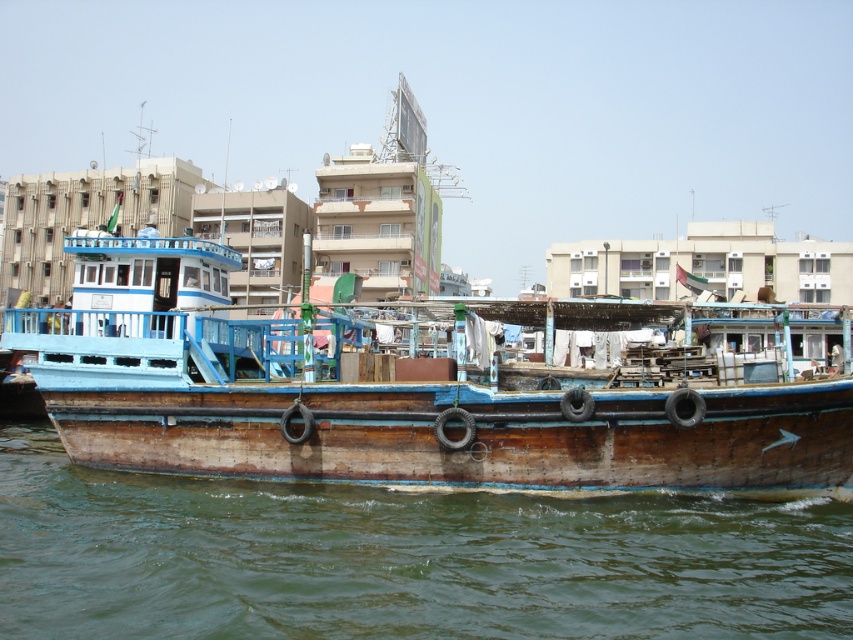
Consider the image. You are standing on the dock and see the wooden boat at center and the brown wooden water at lower center. Which object is higher in height?

The wooden boat at center is taller than the brown wooden water at lower center.

You are a dock worker who needs to secure the wooden boat at center to the brown wooden water at lower center. The safety regulations state that the boat must be within 30 feet to safely attach the mooring lines. Can you safely secure the boat using the mooring lines?

The wooden boat at center is 28.22 feet away from the brown wooden water at lower center, which is within the 30 feet safety regulation. Therefore, you can safely secure the wooden boat at center using the mooring lines.

You are a photographer trying to capture the wooden boat at center and the brown wooden water at lower center in a single shot. Since the camera has a limited field of view, you need to know which object is bigger to adjust the zoom accordingly. Which object should you focus on first to ensure both are in frame?

The wooden boat at center is larger in size than the brown wooden water at lower center. To ensure both are in frame, focus on the larger object first, which is the wooden boat at center, then adjust the zoom to include the smaller brown wooden water at lower center.